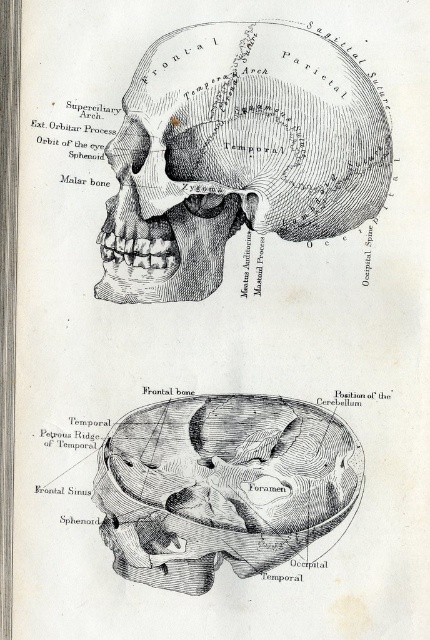
Is etched paper skull at upper center bigger than black ink drawing of skull at center?

Yes, etched paper skull at upper center is bigger than black ink drawing of skull at center.

Does etched paper skull at upper center appear over black ink drawing of skull at center?

Correct, etched paper skull at upper center is located above black ink drawing of skull at center.

Is point (113, 145) in front of point (309, 420)?

Yes, it is.

Locate an element on the screen. etched paper skull at upper center is located at coordinates (236, 154).